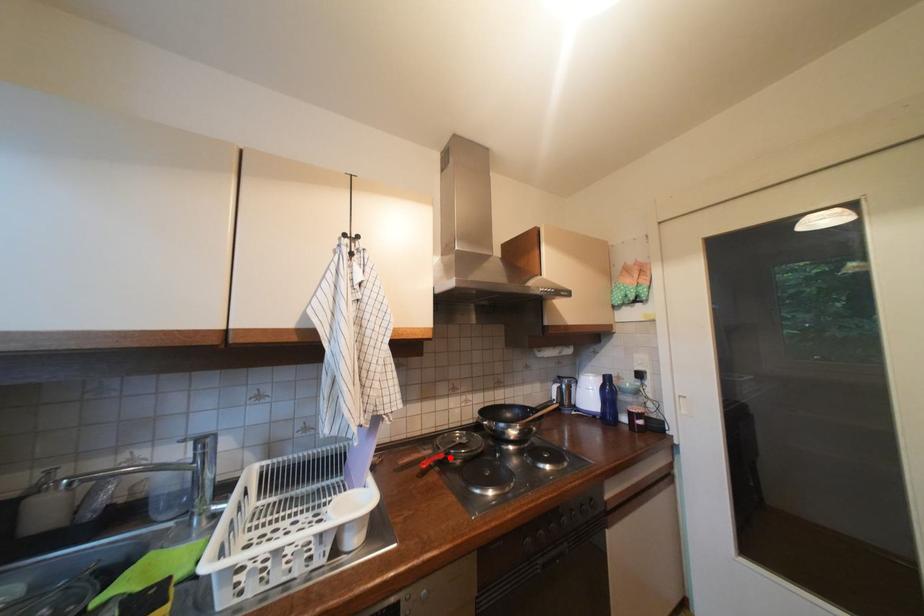
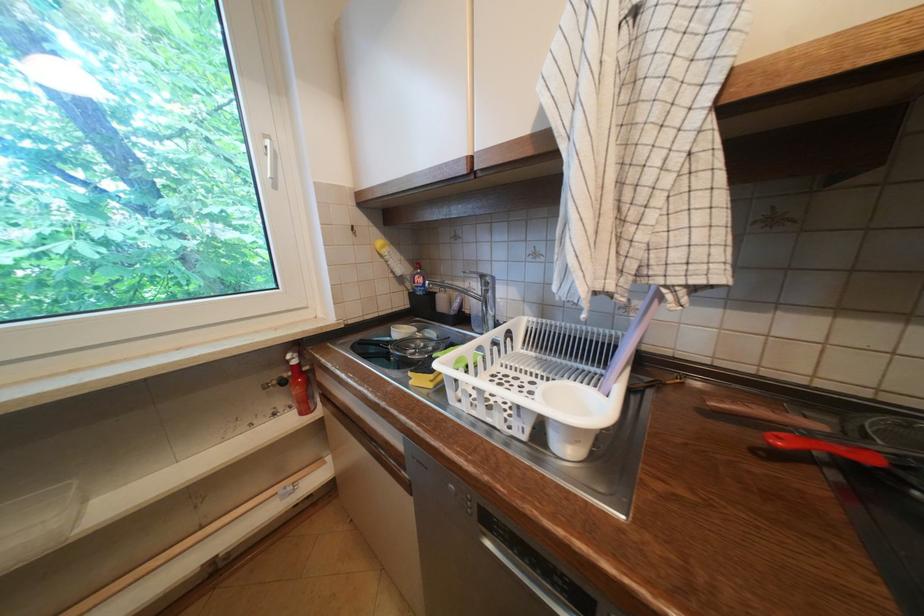
Find the pixel in the second image that matches the highlighted location in the first image.

(881, 462)